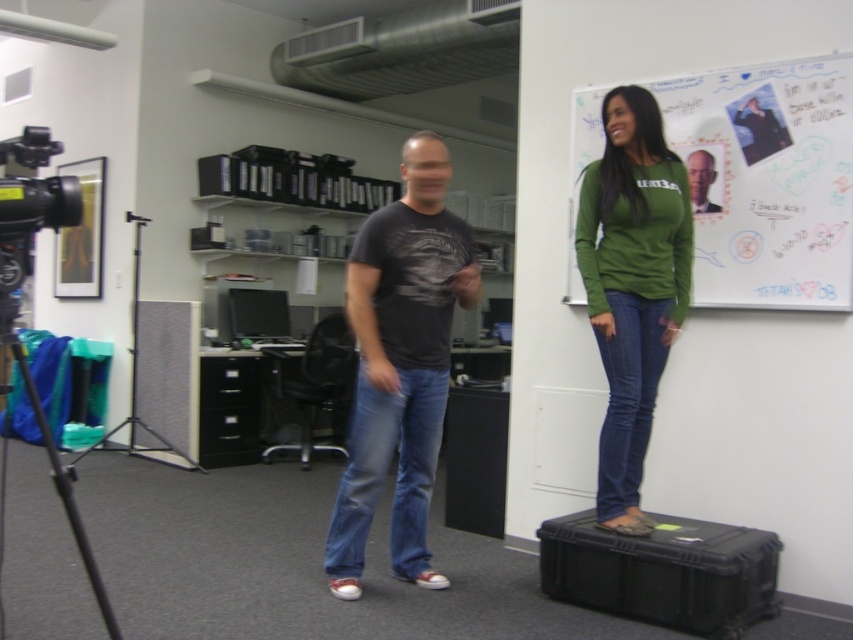
Can you confirm if black matte tripod at left is positioned above smooth gray hair at upper center?

No.

Which of these two, black matte tripod at left or smooth gray hair at upper center, stands shorter?

With less height is smooth gray hair at upper center.

Locate an element on the screen. Image resolution: width=853 pixels, height=640 pixels. black matte tripod at left is located at coordinates (55, 461).

Can you confirm if green matte whiteboard at upper right is thinner than smooth gray hair at upper center?

No, green matte whiteboard at upper right is not thinner than smooth gray hair at upper center.

Where is `green matte whiteboard at upper right`? green matte whiteboard at upper right is located at coordinates click(769, 180).

Does point (813, 84) lie behind point (712, 211)?

No, (813, 84) is closer to viewer.

At what (x,y) coordinates should I click in order to perform the action: click on green matte whiteboard at upper right. Please return your answer as a coordinate pair (x, y). Looking at the image, I should click on (769, 180).

Which is behind, point (816, 186) or point (4, 333)?

The point (816, 186) is behind.

This screenshot has height=640, width=853. What do you see at coordinates (769, 180) in the screenshot?
I see `green matte whiteboard at upper right` at bounding box center [769, 180].

Between point (740, 268) and point (68, 502), which one is positioned in front?

Point (68, 502)

The width and height of the screenshot is (853, 640). In order to click on green matte whiteboard at upper right in this screenshot , I will do `click(769, 180)`.